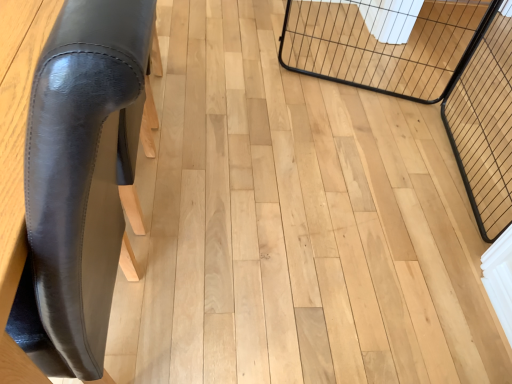
Question: Does black wire mesh cage at right, the second cage in the left-to-right sequence, have a smaller size compared to black leather chair at left?

Choices:
 (A) yes
 (B) no

Answer: (A)

Question: Is black wire mesh cage at right, the second cage in the left-to-right sequence, wider than black leather chair at left?

Choices:
 (A) yes
 (B) no

Answer: (A)

Question: Is black wire mesh cage at right, which ranks as the 1th cage in right-to-left order, oriented away from black leather chair at left?

Choices:
 (A) no
 (B) yes

Answer: (A)

Question: From a real-world perspective, is black wire mesh cage at right, which ranks as the 1th cage in right-to-left order, below black leather chair at left?

Choices:
 (A) no
 (B) yes

Answer: (B)

Question: From a real-world perspective, is black wire mesh cage at right, the second cage in the left-to-right sequence, physically above black leather chair at left?

Choices:
 (A) yes
 (B) no

Answer: (B)

Question: Can you confirm if black wire mesh cage at right, which ranks as the 1th cage in right-to-left order, is positioned to the right of black leather chair at left?

Choices:
 (A) no
 (B) yes

Answer: (B)

Question: From a real-world perspective, is black wire cage at upper right, acting as the 1th cage starting from the left, on top of black wire mesh cage at right, which ranks as the 1th cage in right-to-left order?

Choices:
 (A) yes
 (B) no

Answer: (A)

Question: Can black wire mesh cage at right, the second cage in the left-to-right sequence, be found inside black wire cage at upper right, the second cage in the right-to-left sequence?

Choices:
 (A) no
 (B) yes

Answer: (A)

Question: Can we say black wire cage at upper right, the second cage in the right-to-left sequence, lies outside black wire mesh cage at right, which ranks as the 1th cage in right-to-left order?

Choices:
 (A) yes
 (B) no

Answer: (A)

Question: Does black wire cage at upper right, the second cage in the right-to-left sequence, appear on the right side of black wire mesh cage at right, which ranks as the 1th cage in right-to-left order?

Choices:
 (A) no
 (B) yes

Answer: (A)

Question: Does black wire cage at upper right, the second cage in the right-to-left sequence, have a lesser width compared to black wire mesh cage at right, which ranks as the 1th cage in right-to-left order?

Choices:
 (A) yes
 (B) no

Answer: (A)

Question: Does black wire cage at upper right, acting as the 1th cage starting from the left, have a smaller size compared to black wire mesh cage at right, the second cage in the left-to-right sequence?

Choices:
 (A) no
 (B) yes

Answer: (B)

Question: Considering the relative sizes of black wire mesh cage at right, which ranks as the 1th cage in right-to-left order, and black wire cage at upper right, acting as the 1th cage starting from the left, in the image provided, is black wire mesh cage at right, which ranks as the 1th cage in right-to-left order, smaller than black wire cage at upper right, acting as the 1th cage starting from the left,?

Choices:
 (A) yes
 (B) no

Answer: (B)